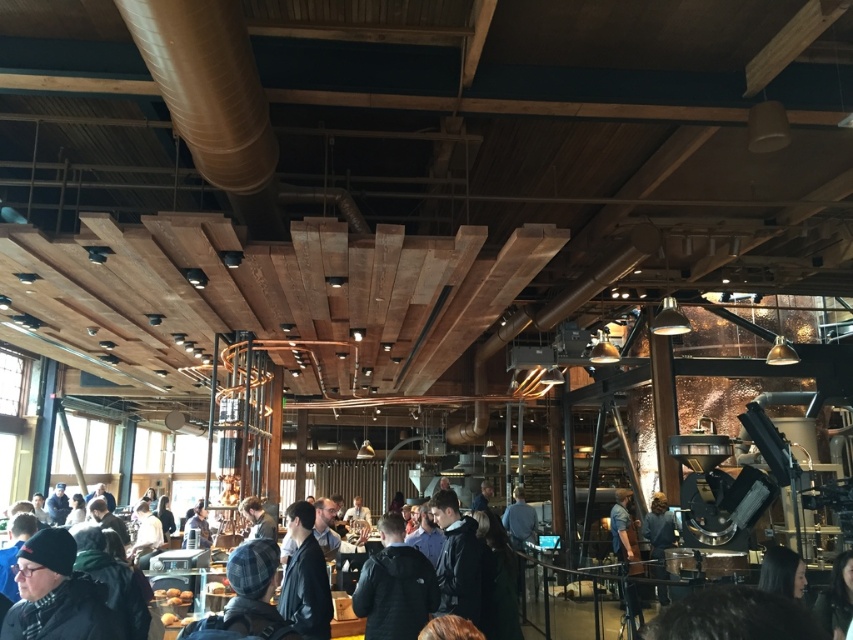
Question: Can you confirm if dark blue jacket at center is positioned to the right of smooth black hair at lower right?

Choices:
 (A) yes
 (B) no

Answer: (B)

Question: Which point appears farthest from the camera in this image?

Choices:
 (A) (786, 557)
 (B) (436, 596)
 (C) (619, 520)

Answer: (C)

Question: Can you confirm if smooth black hair at lower right is positioned above blue shirt at center?

Choices:
 (A) no
 (B) yes

Answer: (B)

Question: Which point is closer to the camera?

Choices:
 (A) (419, 611)
 (B) (624, 531)

Answer: (A)

Question: Is the position of dark blue jacket at center more distant than that of blue shirt at center?

Choices:
 (A) yes
 (B) no

Answer: (B)

Question: Which of the following is the closest to the observer?

Choices:
 (A) dark blue jacket at center
 (B) blue shirt at center

Answer: (A)